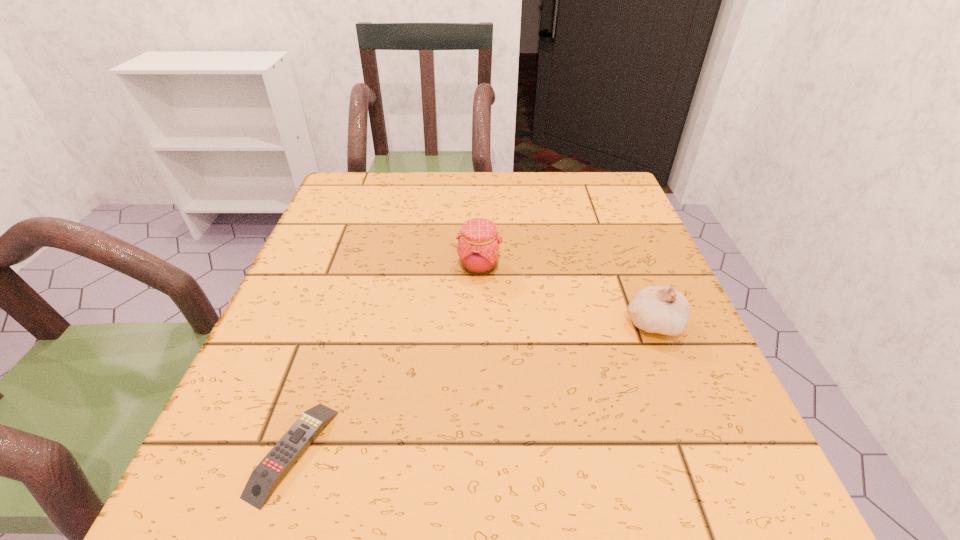
Locate an element on the screen. The height and width of the screenshot is (540, 960). the second closest object to the jam is located at coordinates 263,480.

The height and width of the screenshot is (540, 960). In order to click on vacant space that satisfies the following two spatial constraints: 1. on the back side of the shortest object; 2. on the left side of the second nearest object in this screenshot , I will do `click(336, 324)`.

You are a GUI agent. You are given a task and a screenshot of the screen. Output one action in this format:
    pyautogui.click(x=<x>, y=<y>)
    Task: Click on the free spot that satisfies the following two spatial constraints: 1. on the back side of the remote control; 2. on the right side of the garlic
    
    Given the screenshot: What is the action you would take?
    pyautogui.click(x=336, y=324)

What are the coordinates of `vacant space that satisfies the following two spatial constraints: 1. on the back side of the shortest object; 2. on the left side of the second object from left to right` in the screenshot? It's located at (355, 267).

Where is `free region that satisfies the following two spatial constraints: 1. on the back side of the second object from right to left; 2. on the right side of the leftmost object`? The width and height of the screenshot is (960, 540). free region that satisfies the following two spatial constraints: 1. on the back side of the second object from right to left; 2. on the right side of the leftmost object is located at coordinates (355, 267).